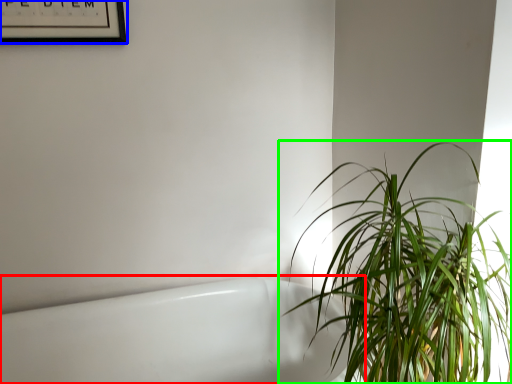
Question: Which is farther away from bath (highlighted by a red box)? picture frame (highlighted by a blue box) or houseplant (highlighted by a green box)?

Choices:
 (A) picture frame
 (B) houseplant

Answer: (A)